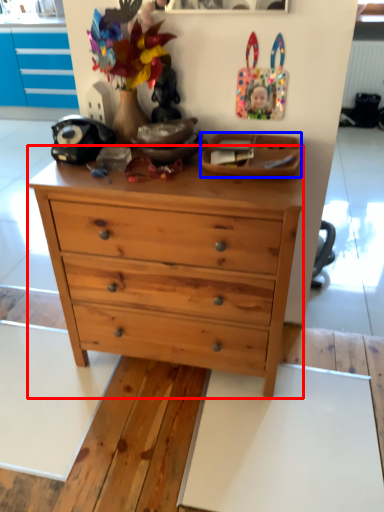
Question: Which point is further to the camera, chest of drawers (highlighted by a red box) or plate (highlighted by a blue box)?

Choices:
 (A) chest of drawers
 (B) plate

Answer: (B)